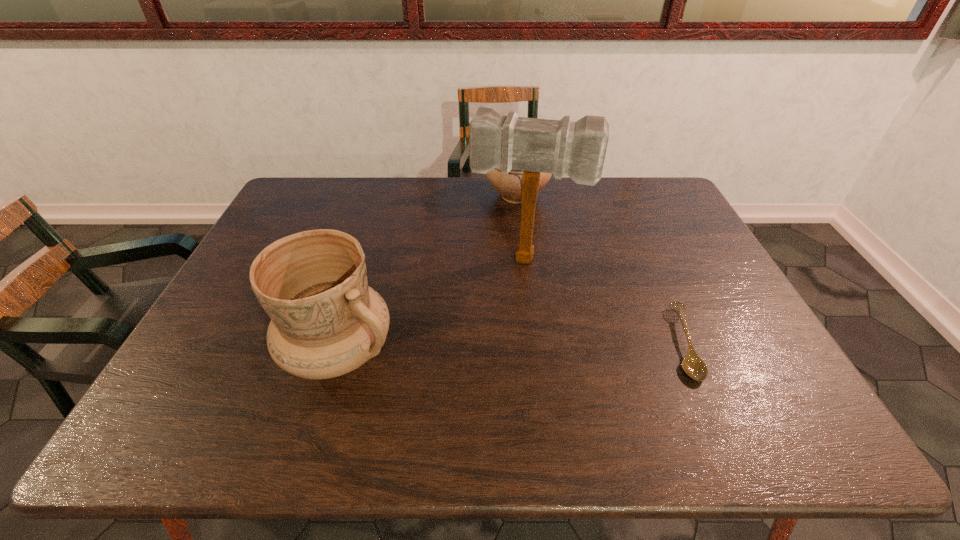
Where is `free spot at the near edge of the desktop`? free spot at the near edge of the desktop is located at coordinates (652, 362).

The width and height of the screenshot is (960, 540). In the image, there is a desktop. Find the location of `vacant space at the left edge`. vacant space at the left edge is located at coordinates (x=239, y=352).

Where is `vacant position at the far left corner of the desktop`? vacant position at the far left corner of the desktop is located at coordinates (298, 183).

The image size is (960, 540). I want to click on free space at the far right corner, so click(x=653, y=202).

Identify the location of vacant space at the near right corner. (767, 388).

The image size is (960, 540). In order to click on empty location between the pottery and the farthest object in this screenshot , I will do (428, 273).

This screenshot has width=960, height=540. In order to click on free space between the urn and the leftmost object in this screenshot , I will do `click(428, 273)`.

Find the location of a particular element. The width and height of the screenshot is (960, 540). empty location between the rightmost object and the tallest object is located at coordinates (605, 301).

In order to click on free space that is in between the tallest object and the pottery in this screenshot , I will do `click(433, 306)`.

This screenshot has height=540, width=960. I want to click on free space between the pottery and the ladle, so click(x=511, y=347).